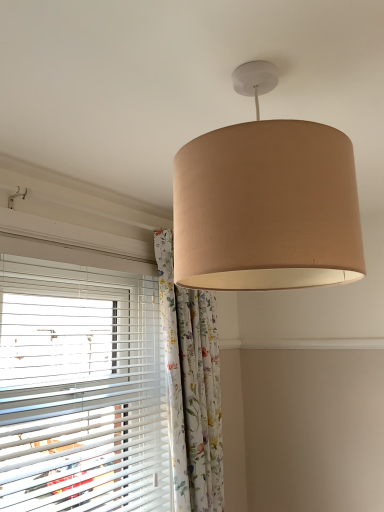
Describe the element at coordinates (191, 387) in the screenshot. I see `floral fabric curtain at center` at that location.

You are a GUI agent. You are given a task and a screenshot of the screen. Output one action in this format:
    pyautogui.click(x=<x>, y=<y>)
    Task: Click on the floral fabric curtain at center
    Image resolution: width=384 pixels, height=512 pixels.
    Given the screenshot: What is the action you would take?
    pyautogui.click(x=191, y=387)

How many degrees apart are the facing directions of white plastic blinds at left and floral fabric curtain at center?

The facing directions of white plastic blinds at left and floral fabric curtain at center are 1.29 degrees apart.

Are white plastic blinds at left and floral fabric curtain at center beside each other?

No, white plastic blinds at left is not next to floral fabric curtain at center.

Identify the location of window blind in front of the floral fabric curtain at center. This screenshot has width=384, height=512. (80, 384).

Measure the distance between white plastic blinds at left and floral fabric curtain at center.

27.70 centimeters.

Is white plastic blinds at left inside the boundaries of beige fabric lampshade at upper center, or outside?

white plastic blinds at left is not inside beige fabric lampshade at upper center, it's outside.

Considering the sizes of objects white plastic blinds at left and beige fabric lampshade at upper center in the image provided, who is shorter, white plastic blinds at left or beige fabric lampshade at upper center?

beige fabric lampshade at upper center is shorter.

Visually, is white plastic blinds at left positioned to the left or to the right of beige fabric lampshade at upper center?

white plastic blinds at left is to the left of beige fabric lampshade at upper center.

Looking at this image, from a real-world perspective, is white plastic blinds at left beneath beige fabric lampshade at upper center?

Yes, from a real-world perspective, white plastic blinds at left is under beige fabric lampshade at upper center.

Is floral fabric curtain at center turned away from white plastic blinds at left?

floral fabric curtain at center is not turned away from white plastic blinds at left.

Is floral fabric curtain at center situated inside white plastic blinds at left or outside?

floral fabric curtain at center is spatially situated outside white plastic blinds at left.

Considering the sizes of objects floral fabric curtain at center and white plastic blinds at left in the image provided, who is wider, floral fabric curtain at center or white plastic blinds at left?

floral fabric curtain at center.

From a real-world perspective, is floral fabric curtain at center positioned under white plastic blinds at left based on gravity?

Yes, from a real-world perspective, floral fabric curtain at center is below white plastic blinds at left.

Which object is positioned more to the left, beige fabric lampshade at upper center or white plastic blinds at left?

Positioned to the left is white plastic blinds at left.

Which of these two, beige fabric lampshade at upper center or white plastic blinds at left, is smaller?

Smaller between the two is beige fabric lampshade at upper center.

Between beige fabric lampshade at upper center and white plastic blinds at left, which one has less height?

With less height is beige fabric lampshade at upper center.

Consider the image. Is floral fabric curtain at center not near beige fabric lampshade at upper center?

No, floral fabric curtain at center is not far from beige fabric lampshade at upper center.

Can you confirm if floral fabric curtain at center is taller than beige fabric lampshade at upper center?

Yes, floral fabric curtain at center is taller than beige fabric lampshade at upper center.

Between beige fabric lampshade at upper center and floral fabric curtain at center, which one has smaller width?

floral fabric curtain at center.

From a real-world perspective, which object rests below the other?

floral fabric curtain at center.

Is beige fabric lampshade at upper center turned away from floral fabric curtain at center?

That's not correct — beige fabric lampshade at upper center is not looking away from floral fabric curtain at center.

In order to click on curtain located underneath the beige fabric lampshade at upper center (from a real-world perspective) in this screenshot , I will do `click(191, 387)`.

This screenshot has width=384, height=512. I want to click on window blind that appears in front of the floral fabric curtain at center, so click(x=80, y=384).

What are the coordinates of `lamp above the white plastic blinds at left (from a real-world perspective)` in the screenshot? It's located at coord(266,202).

In the scene shown: When comparing their distances from floral fabric curtain at center, does beige fabric lampshade at upper center or white plastic blinds at left seem closer?

Based on the image, white plastic blinds at left appears to be nearer to floral fabric curtain at center.

Based on the photo, estimate the real-world distances between objects in this image. Which object is further from white plastic blinds at left, floral fabric curtain at center or beige fabric lampshade at upper center?

Among the two, beige fabric lampshade at upper center is located further to white plastic blinds at left.

From the picture: Based on their spatial positions, is white plastic blinds at left or beige fabric lampshade at upper center further from floral fabric curtain at center?

beige fabric lampshade at upper center is positioned further to the anchor floral fabric curtain at center.

Considering their positions, is floral fabric curtain at center positioned further to beige fabric lampshade at upper center than white plastic blinds at left?

Based on the image, floral fabric curtain at center appears to be further to beige fabric lampshade at upper center.

Estimate the real-world distances between objects in this image. Which object is further from white plastic blinds at left, beige fabric lampshade at upper center or floral fabric curtain at center?

Based on the image, beige fabric lampshade at upper center appears to be further to white plastic blinds at left.

When comparing their distances from beige fabric lampshade at upper center, does white plastic blinds at left or floral fabric curtain at center seem further?

The object further to beige fabric lampshade at upper center is floral fabric curtain at center.

At what (x,y) coordinates should I click in order to perform the action: click on window blind between beige fabric lampshade at upper center and floral fabric curtain at center along the z-axis. Please return your answer as a coordinate pair (x, y). Looking at the image, I should click on (80, 384).